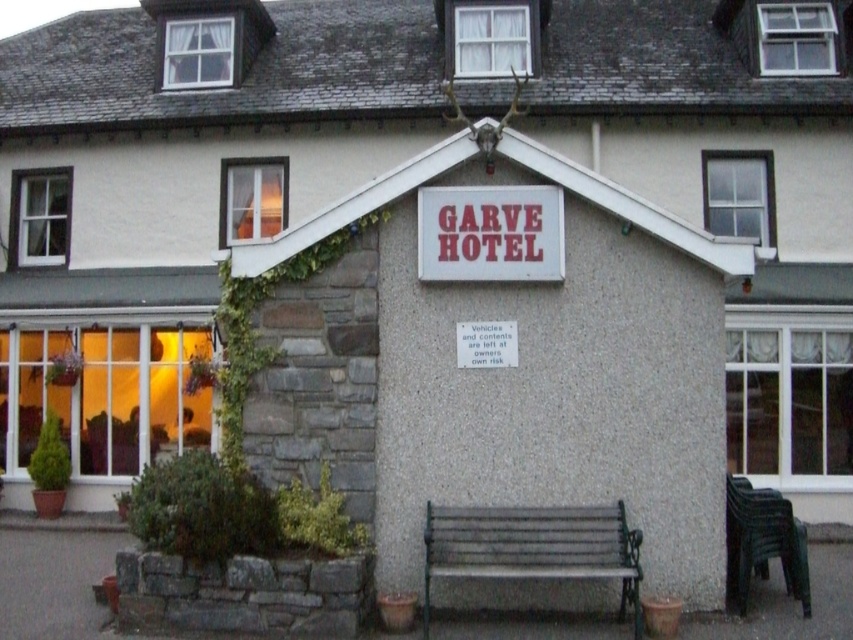
Is green metal bench at lower center below black plastic bench at lower right?

No, green metal bench at lower center is not below black plastic bench at lower right.

Who is higher up, green metal bench at lower center or black plastic bench at lower right?

green metal bench at lower center is higher up.

At what (x,y) coordinates should I click in order to perform the action: click on green metal bench at lower center. Please return your answer as a coordinate pair (x, y). Looking at the image, I should click on (532, 547).

Is point (560, 212) behind point (804, 576)?

No, (560, 212) is closer to viewer.

In order to click on red plastic sign at center in this screenshot , I will do `click(490, 234)`.

Is the position of green metal bench at lower center less distant than that of red plastic sign at center?

That is True.

Which is more to the right, green metal bench at lower center or red plastic sign at center?

green metal bench at lower center

Does point (637, 582) lie behind point (546, 228)?

That is False.

Locate an element on the screen. The height and width of the screenshot is (640, 853). green metal bench at lower center is located at coordinates (532, 547).